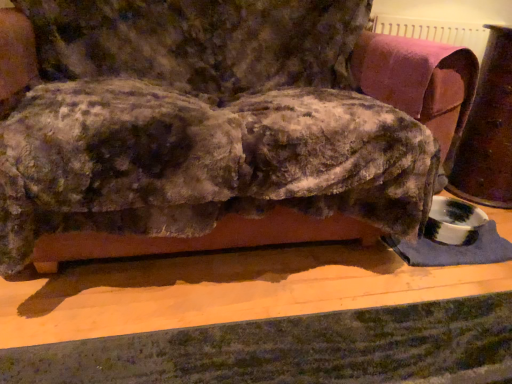
What do you see at coordinates (201, 128) in the screenshot? This screenshot has width=512, height=384. I see `velvet fabric couch at center` at bounding box center [201, 128].

Image resolution: width=512 pixels, height=384 pixels. I want to click on velvet fabric couch at center, so click(201, 128).

Locate an element on the screen. velvet fabric couch at center is located at coordinates (201, 128).